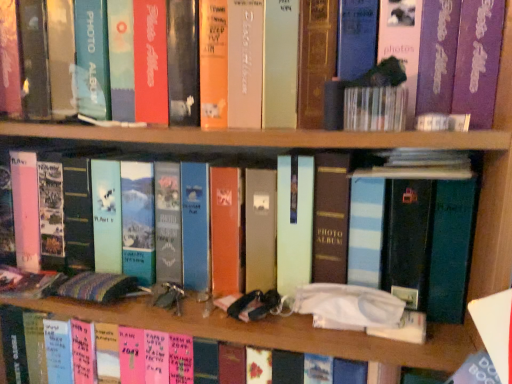
Question: Is blue striped photo album at center, the first book in the top-to-bottom sequence, at the right side of white matte tissue box at center, arranged as the first book when ordered from the bottom?

Choices:
 (A) no
 (B) yes

Answer: (A)

Question: Does blue striped photo album at center, the 2th book from the bottom, have a smaller size compared to white matte tissue box at center, arranged as the first book when ordered from the bottom?

Choices:
 (A) no
 (B) yes

Answer: (B)

Question: From the image's perspective, is blue striped photo album at center, the 2th book from the bottom, located beneath white matte tissue box at center, which is the second book in top-to-bottom order?

Choices:
 (A) no
 (B) yes

Answer: (A)

Question: Is blue striped photo album at center, the 2th book from the bottom, facing towards white matte tissue box at center, arranged as the first book when ordered from the bottom?

Choices:
 (A) no
 (B) yes

Answer: (A)

Question: Does blue striped photo album at center, the 2th book from the bottom, have a greater width compared to white matte tissue box at center, arranged as the first book when ordered from the bottom?

Choices:
 (A) yes
 (B) no

Answer: (B)

Question: From the image's perspective, does blue striped photo album at center, the 2th book from the bottom, appear higher than white matte tissue box at center, which is the second book in top-to-bottom order?

Choices:
 (A) no
 (B) yes

Answer: (B)

Question: Is white matte tissue box at center, which is the second book in top-to-bottom order, positioned with its back to blue striped photo album at center, the 2th book from the bottom?

Choices:
 (A) no
 (B) yes

Answer: (A)

Question: Considering the relative positions of white matte tissue box at center, arranged as the first book when ordered from the bottom, and blue striped photo album at center, the first book in the top-to-bottom sequence, in the image provided, is white matte tissue box at center, arranged as the first book when ordered from the bottom, to the right of blue striped photo album at center, the first book in the top-to-bottom sequence, from the viewer's perspective?

Choices:
 (A) no
 (B) yes

Answer: (B)

Question: From the image's perspective, is white matte tissue box at center, which is the second book in top-to-bottom order, on blue striped photo album at center, the first book in the top-to-bottom sequence?

Choices:
 (A) yes
 (B) no

Answer: (B)

Question: Can you confirm if white matte tissue box at center, arranged as the first book when ordered from the bottom, is bigger than blue striped photo album at center, the first book in the top-to-bottom sequence?

Choices:
 (A) no
 (B) yes

Answer: (B)

Question: Does white matte tissue box at center, arranged as the first book when ordered from the bottom, turn towards blue striped photo album at center, the first book in the top-to-bottom sequence?

Choices:
 (A) no
 (B) yes

Answer: (A)

Question: Is white matte tissue box at center, arranged as the first book when ordered from the bottom, smaller than blue striped photo album at center, the 2th book from the bottom?

Choices:
 (A) no
 (B) yes

Answer: (A)

Question: Considering the positions of white matte tissue box at center, which is the second book in top-to-bottom order, and blue striped photo album at center, the 2th book from the bottom, in the image, is white matte tissue box at center, which is the second book in top-to-bottom order, wider or thinner than blue striped photo album at center, the 2th book from the bottom,?

Choices:
 (A) wide
 (B) thin

Answer: (A)